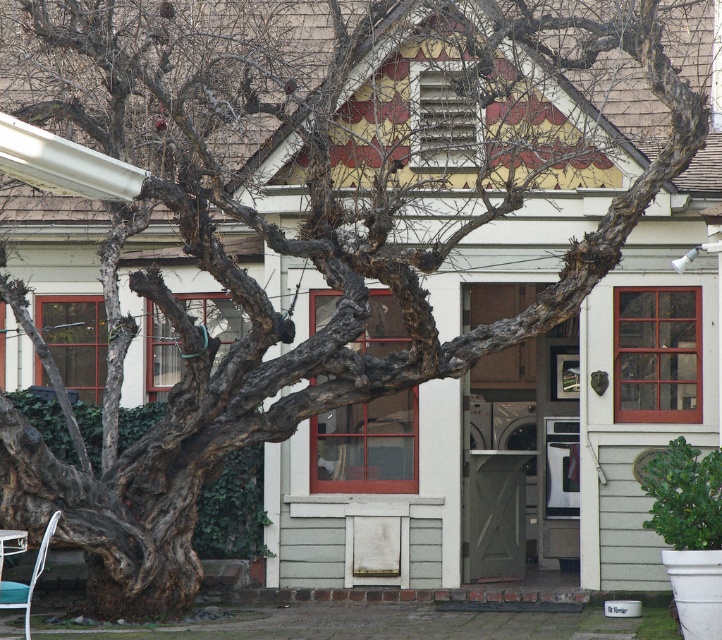
Between dark brown rough bark at lower left and metallic white chair at lower left, which one is positioned lower?

metallic white chair at lower left is lower down.

At what (x,y) coordinates should I click in order to perform the action: click on dark brown rough bark at lower left. Please return your answer as a coordinate pair (x, y). The image size is (722, 640). Looking at the image, I should click on (108, 515).